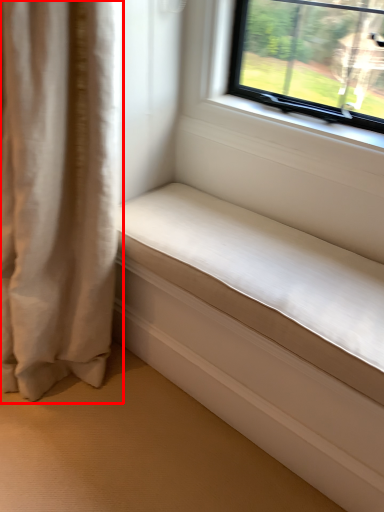
Question: Considering the relative positions of curtain (annotated by the red box) and studio couch in the image provided, where is curtain (annotated by the red box) located with respect to the staircase?

Choices:
 (A) left
 (B) right

Answer: (A)